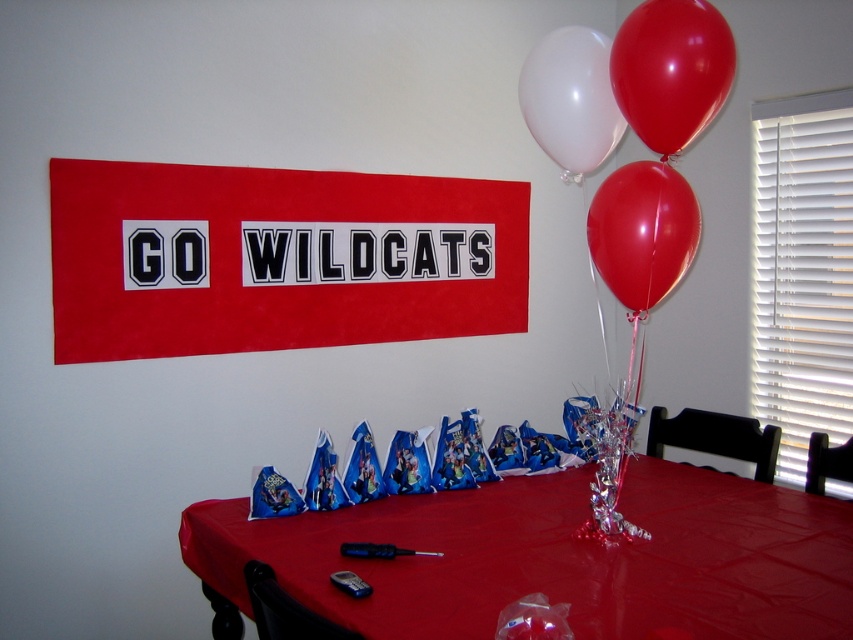
You are planning to hang a new decoration between the red fabric banner at upper center and the rubber glossy balloon at upper right. Since the space available is limited, which of the two items is shorter and can be moved to make room?

The rubber glossy balloon at upper right is shorter than the red fabric banner at upper center, so moving it would allow more space for the new decoration.

You are a photographer setting up for a party photo. You need to ensure that both the red fabric banner at upper center and the rubber glossy balloon at upper right are in focus. Which object should you adjust your camera focus on first to ensure both are sharp?

Since the red fabric banner at upper center is closer to the viewer than the rubber glossy balloon at upper right, you should focus on the red fabric banner at upper center first. This will ensure the balloon is also in focus as it is further away.

You are standing in front of the festive table setup. There are two points marked on the image. The first point is at coordinates point [654,296] and the second point is at point [576,32]. Which of these two points is closer to you?

Point [654,296] is closer to the camera than point [576,32].